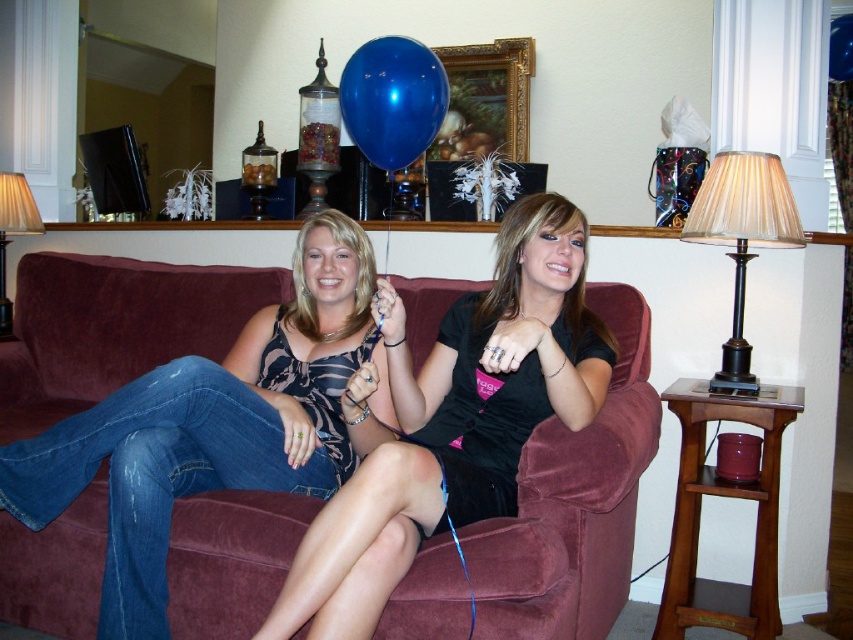
You are arranging a living room and want to place a new sofa. The velvet maroon couch at center and the matte beige lampshade at upper left are already in the room. Based on their positions, where should you place the new sofa relative to the existing lampshade?

The velvet maroon couch at center is below the matte beige lampshade at upper left, so the new sofa should be placed below the existing lampshade to maintain the same layout.